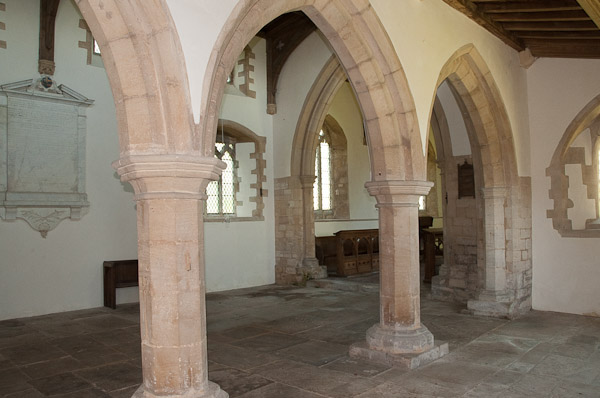
Locate an element on the screen. This screenshot has width=600, height=398. bench is located at coordinates (350, 258).